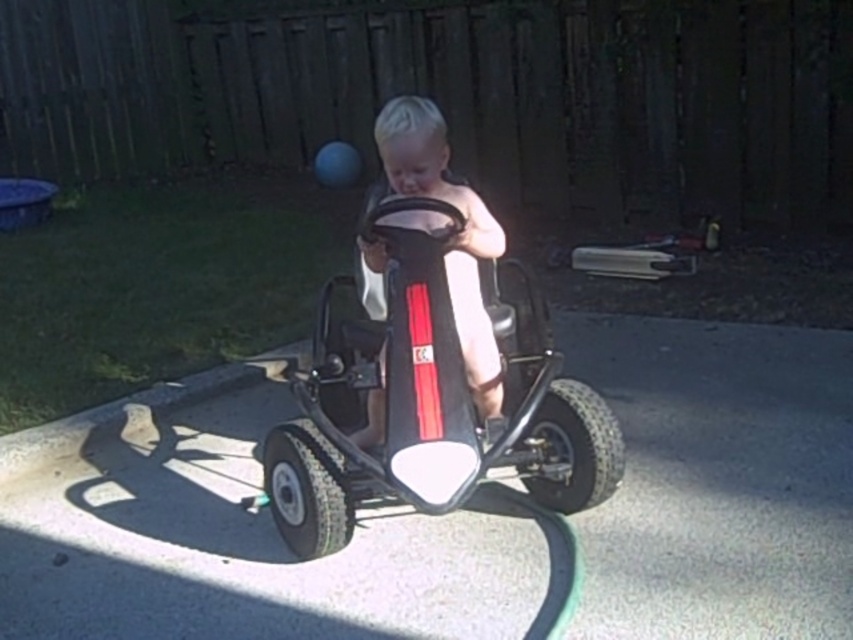
Is black matte go-kart at center above matte black go-kart at center?

Incorrect, black matte go-kart at center is not positioned above matte black go-kart at center.

What do you see at coordinates (430, 406) in the screenshot?
I see `black matte go-kart at center` at bounding box center [430, 406].

At what (x,y) coordinates should I click in order to perform the action: click on black matte go-kart at center. Please return your answer as a coordinate pair (x, y). This screenshot has width=853, height=640. Looking at the image, I should click on (430, 406).